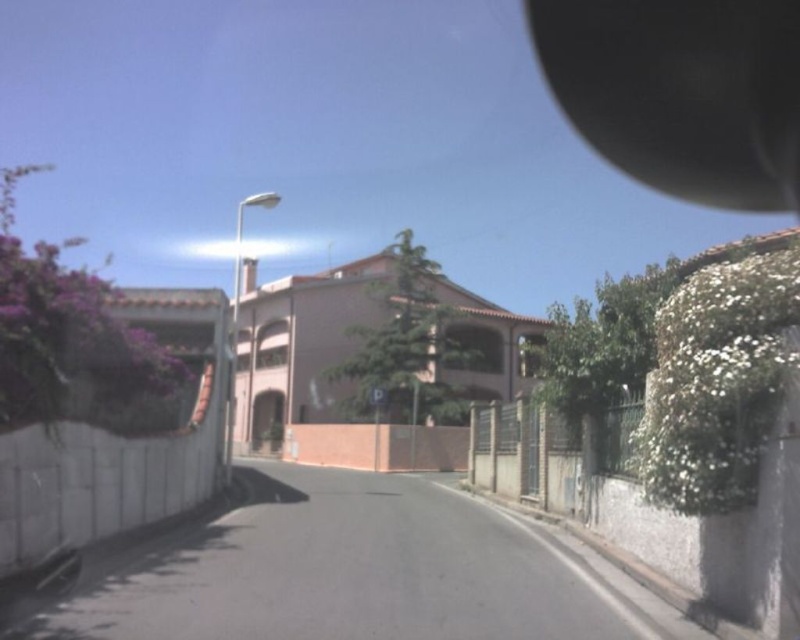
Question: Considering the real-world distances, which object is closest to the brick wall at center?

Choices:
 (A) metallic silver fence at right
 (B) black matte view mirror at upper right

Answer: (A)

Question: Is metallic silver fence at right thinner than brick wall at center?

Choices:
 (A) no
 (B) yes

Answer: (B)

Question: Is metallic silver fence at right smaller than brick wall at center?

Choices:
 (A) yes
 (B) no

Answer: (A)

Question: Is metallic silver fence at right to the left of brick wall at center from the viewer's perspective?

Choices:
 (A) yes
 (B) no

Answer: (B)

Question: Which point is closer to the camera?

Choices:
 (A) black matte view mirror at upper right
 (B) metallic silver fence at right

Answer: (B)

Question: Which object is closer to the camera taking this photo?

Choices:
 (A) brick wall at center
 (B) metallic silver fence at right

Answer: (B)